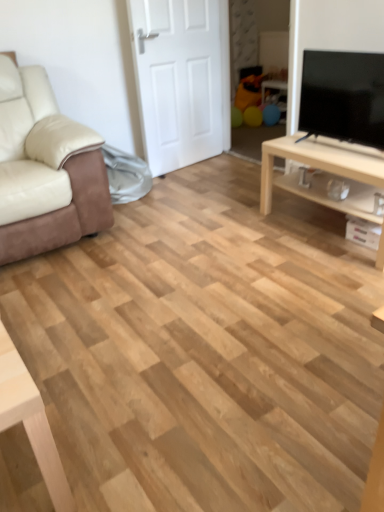
The height and width of the screenshot is (512, 384). Identify the location of free point in front of light wood/texture tv stand at right. (328, 283).